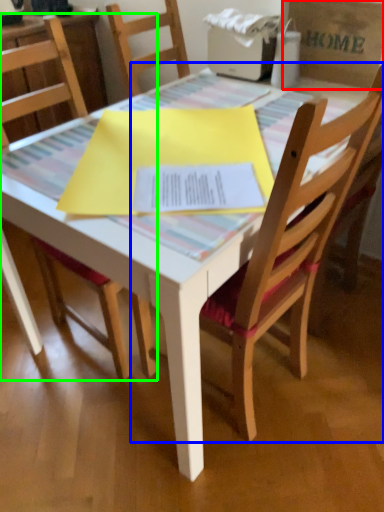
Question: Which is farther away from cardboard box (highlighted by a red box)? chair (highlighted by a blue box) or chair (highlighted by a green box)?

Choices:
 (A) chair
 (B) chair

Answer: (B)